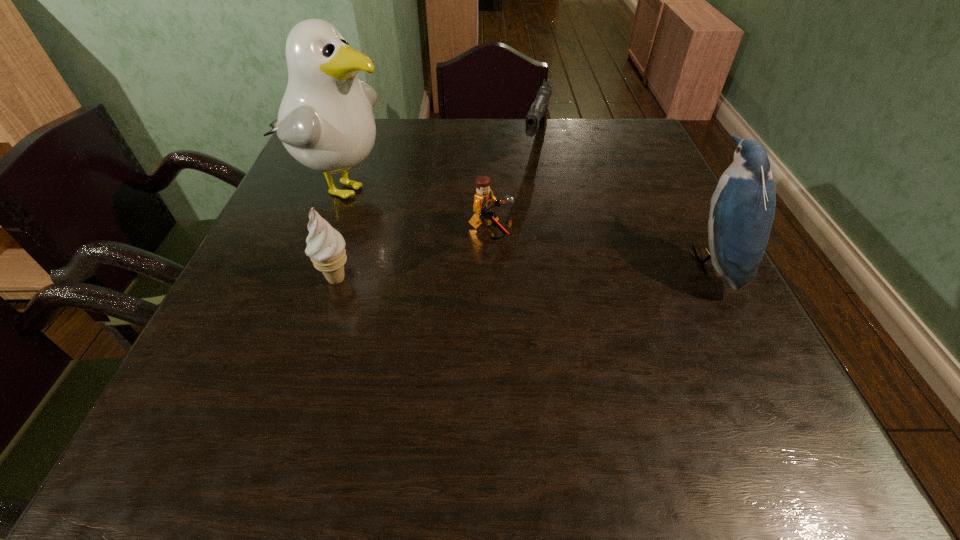
At what (x,y) coordinates should I click in order to perform the action: click on free space between the fourth object from left to right and the third shortest object. Please return your answer as a coordinate pair (x, y). This screenshot has height=540, width=960. Looking at the image, I should click on (436, 211).

Identify the location of free space between the fourth object from left to right and the tallest object. The image size is (960, 540). (439, 164).

Locate an element on the screen. Image resolution: width=960 pixels, height=540 pixels. free spot between the third object from left to right and the bird is located at coordinates (600, 246).

What are the coordinates of `vacant space that's between the gun and the bird` in the screenshot? It's located at (623, 202).

Find the location of a particular element. The height and width of the screenshot is (540, 960). free space between the Lego and the third shortest object is located at coordinates (414, 255).

Where is `unoccupied position between the third object from left to right and the bird`? unoccupied position between the third object from left to right and the bird is located at coordinates (600, 246).

Locate an element on the screen. This screenshot has width=960, height=540. empty space that is in between the Lego and the icecream is located at coordinates (414, 255).

The height and width of the screenshot is (540, 960). In order to click on empty location between the second object from right to left and the gull in this screenshot , I will do `click(439, 164)`.

Where is `unoccupied position between the icecream and the gull`? unoccupied position between the icecream and the gull is located at coordinates (340, 233).

Identify the location of empty location between the bird and the tallest object. (526, 224).